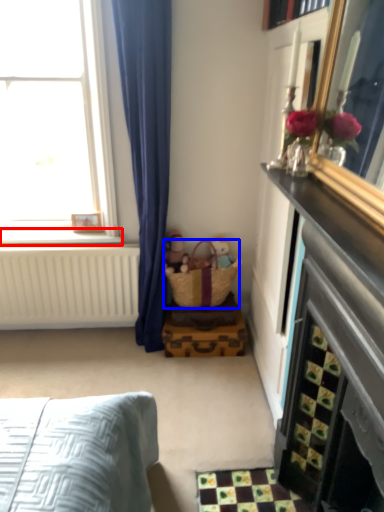
Question: Which object is further to the camera taking this photo, window sill (highlighted by a red box) or basket (highlighted by a blue box)?

Choices:
 (A) window sill
 (B) basket

Answer: (A)